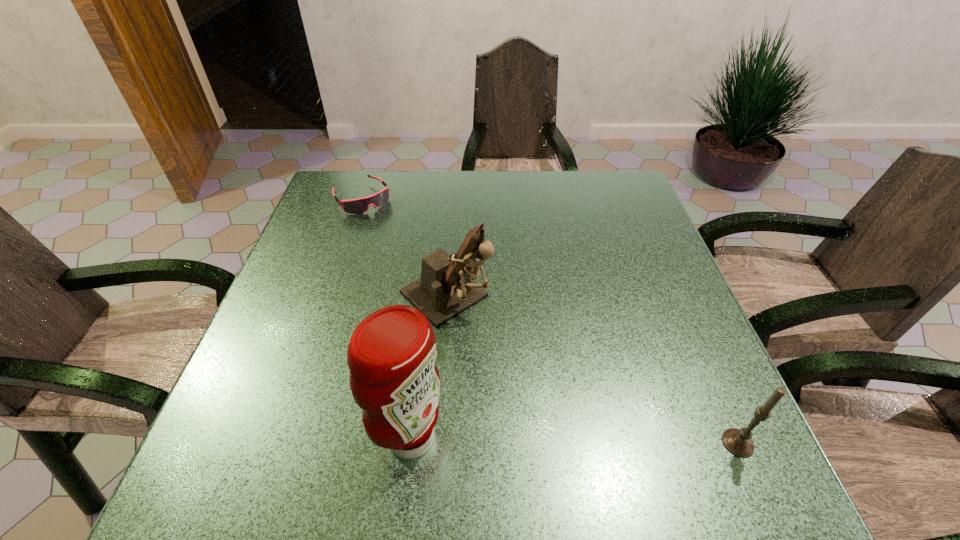
Where is `vacant space situated on the front-facing side of the figurine`? The image size is (960, 540). vacant space situated on the front-facing side of the figurine is located at coordinates (491, 341).

Identify the location of blank space located on the front-facing side of the leftmost object. The image size is (960, 540). (384, 227).

Identify the location of free space located on the front-facing side of the leftmost object. The width and height of the screenshot is (960, 540). click(433, 291).

Where is `free space located on the front-facing side of the leftmost object`? free space located on the front-facing side of the leftmost object is located at coordinates (381, 224).

You are a GUI agent. You are given a task and a screenshot of the screen. Output one action in this format:
    pyautogui.click(x=<x>, y=<y>)
    Task: Click on the object present at the far edge
    The height and width of the screenshot is (540, 960).
    Given the screenshot: What is the action you would take?
    pyautogui.click(x=360, y=205)

You are a GUI agent. You are given a task and a screenshot of the screen. Output one action in this format:
    pyautogui.click(x=<x>, y=<y>)
    Task: Click on the condiment situated at the near edge
    Image resolution: width=960 pixels, height=540 pixels.
    Given the screenshot: What is the action you would take?
    (391, 355)

I want to click on candle that is positioned at the near edge, so click(x=738, y=442).

This screenshot has width=960, height=540. What are the coordinates of `object that is at the left edge` in the screenshot? It's located at click(360, 205).

The image size is (960, 540). What are the coordinates of `object at the right edge` in the screenshot? It's located at (738, 442).

I want to click on object located in the far left corner section of the desktop, so click(360, 205).